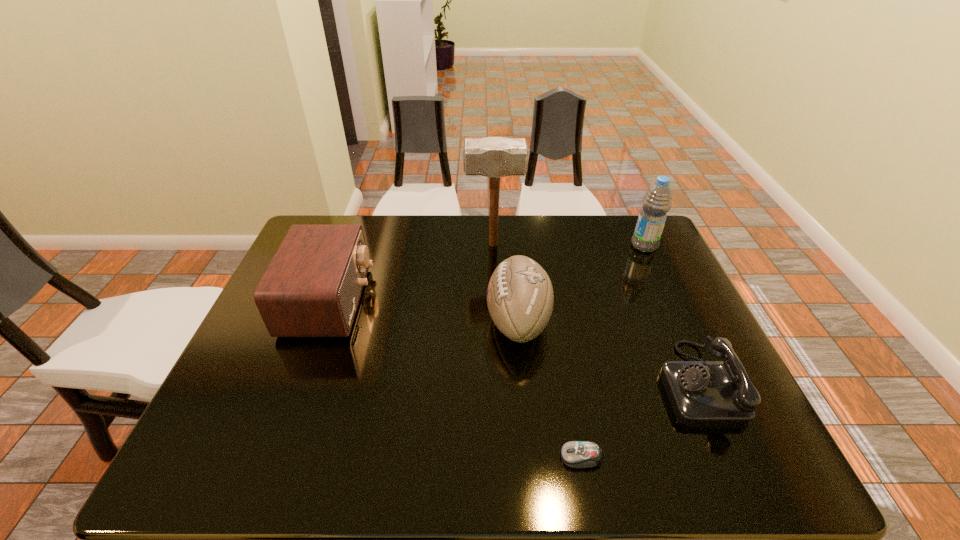
Identify the location of the tallest object. The image size is (960, 540). (494, 157).

Locate an element on the screen. The height and width of the screenshot is (540, 960). the fifth shortest object is located at coordinates (657, 201).

Where is `football (American)`? football (American) is located at coordinates (520, 298).

You are a GUI agent. You are given a task and a screenshot of the screen. Output one action in this format:
    pyautogui.click(x=<x>, y=<y>)
    Task: Click on the leftmost object
    
    Given the screenshot: What is the action you would take?
    pyautogui.click(x=312, y=287)

This screenshot has width=960, height=540. What are the coordinates of `telephone` in the screenshot? It's located at (702, 393).

Find the location of a particular element. the nearest object is located at coordinates (576, 454).

Where is `the shortest object`? Image resolution: width=960 pixels, height=540 pixels. the shortest object is located at coordinates (576, 454).

At what (x,y) coordinates should I click in order to perform the action: click on vacant space located on the striking face of the mallet. Please return your answer as a coordinate pair (x, y). This screenshot has width=960, height=540. Looking at the image, I should click on (421, 245).

Locate an element on the screen. Image resolution: width=960 pixels, height=540 pixels. vacant position located on the striking face of the mallet is located at coordinates (343, 245).

Identify the location of free region located on the striking face of the mallet. The width and height of the screenshot is (960, 540). (393, 245).